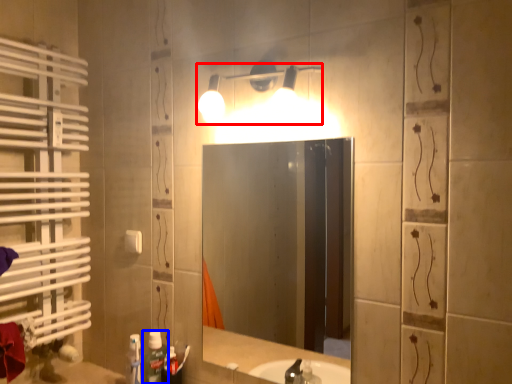
Question: Which object appears closest to the camera in this image, light fixture (highlighted by a red box) or bottle (highlighted by a blue box)?

Choices:
 (A) light fixture
 (B) bottle

Answer: (A)